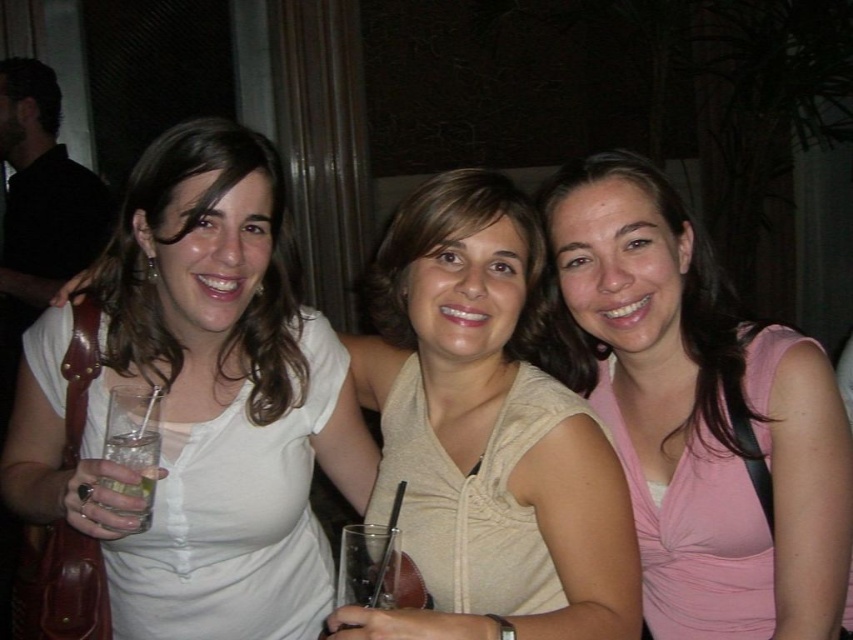
You are standing in a room where three women are posing for a photo. You need to locate the white matte shirt at center. According to the scene description, where would you expect to find it?

The white matte shirt at center is located at the 2D coordinates point (200,403) in the image.

In the scene shown: You are at a social gathering and want to take a photo with the woman wearing the pink satin tank top at center. Where should you position yourself to ensure she is centered in your camera frame?

Position yourself directly in front of the pink satin tank top at center, which is located at coordinates point (700, 413), to ensure she is centered in your camera frame.